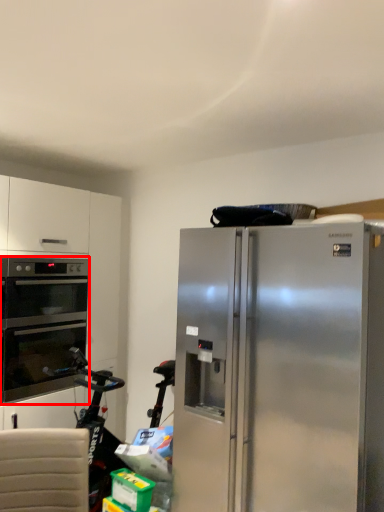
Question: From the image's perspective, considering the relative positions of oven (annotated by the red box) and refrigerator in the image provided, where is oven (annotated by the red box) located with respect to the staircase?

Choices:
 (A) below
 (B) above

Answer: (B)